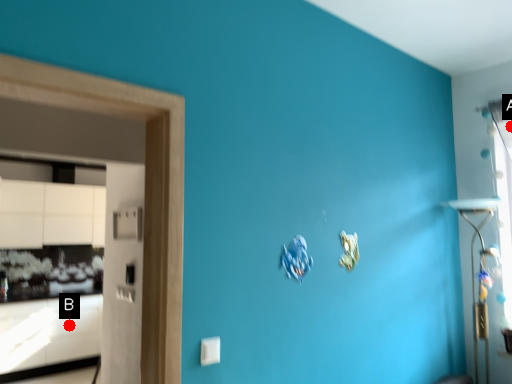
Question: Two points are circled on the image, labeled by A and B beside each circle. Among these points, which one is farthest from the camera?

Choices:
 (A) A is further
 (B) B is further

Answer: (B)